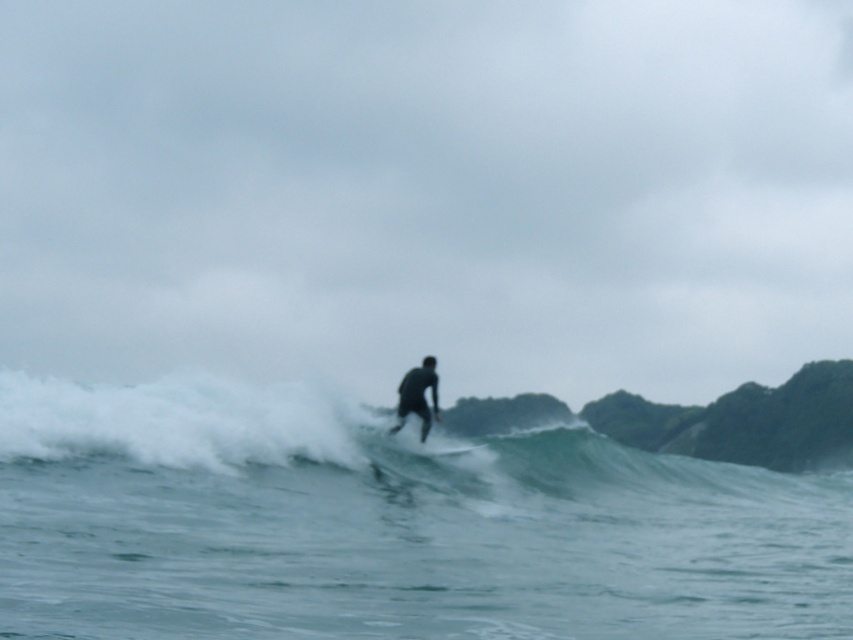
Is greenish-blue water at center further to the viewer compared to black matte surfboard at center?

No.

Is point (741, 625) farther from camera compared to point (424, 381)?

No, it is in front of (424, 381).

You are a GUI agent. You are given a task and a screenshot of the screen. Output one action in this format:
    pyautogui.click(x=<x>, y=<y>)
    Task: Click on the greenish-blue water at center
    The height and width of the screenshot is (640, 853).
    Given the screenshot: What is the action you would take?
    pyautogui.click(x=387, y=525)

Is point (421, 429) positioned in front of point (450, 454)?

No, it is not.

Measure the distance between point (428,385) and camera.

A distance of 23.00 meters exists between point (428,385) and camera.

This screenshot has width=853, height=640. Identify the location of black matte surfboard at center. (416, 396).

Between greenish-blue water at center and white foam surfboard at center, which one has more height?

greenish-blue water at center

Is point (503, 612) farther from camera compared to point (450, 456)?

That is False.

At what (x,y) coordinates should I click in order to perform the action: click on greenish-blue water at center. Please return your answer as a coordinate pair (x, y). The width and height of the screenshot is (853, 640). Looking at the image, I should click on coord(387,525).

Locate an element on the screen. This screenshot has width=853, height=640. greenish-blue water at center is located at coordinates (387, 525).